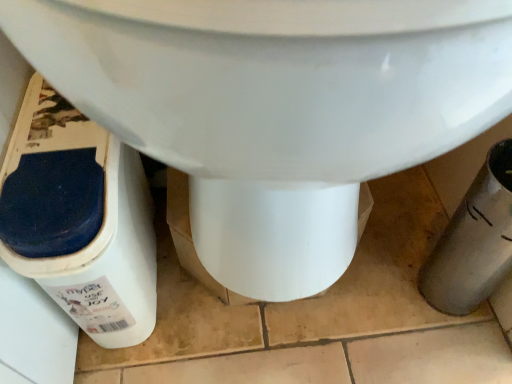
Locate an element on the screen. The width and height of the screenshot is (512, 384). white plastic potty at lower left is located at coordinates (79, 219).

In order to face white plastic potty at lower left, should I rotate leftwards or rightwards?

Turn left approximately 18.892 degrees to face it.

The image size is (512, 384). What do you see at coordinates (79, 219) in the screenshot?
I see `white plastic potty at lower left` at bounding box center [79, 219].

I want to click on white plastic potty at lower left, so click(79, 219).